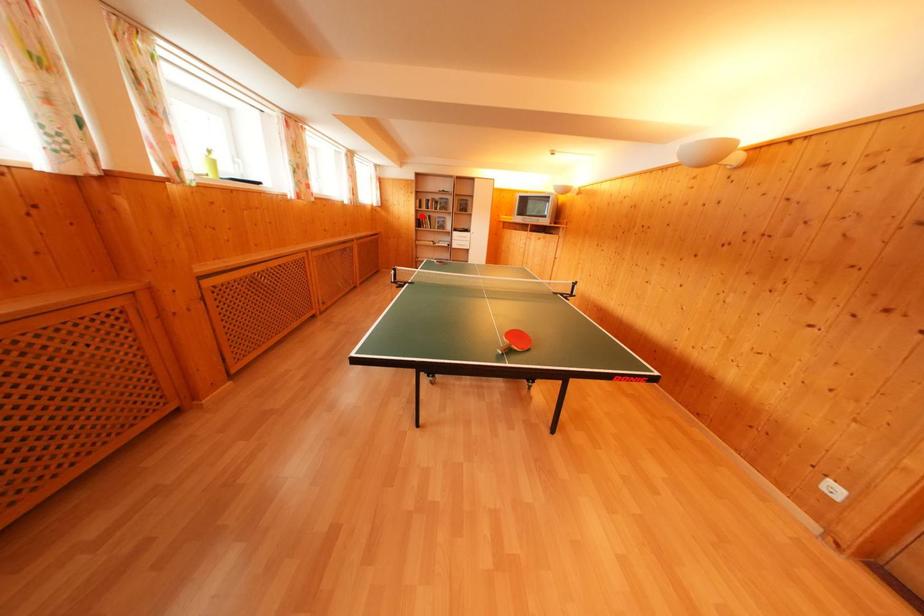
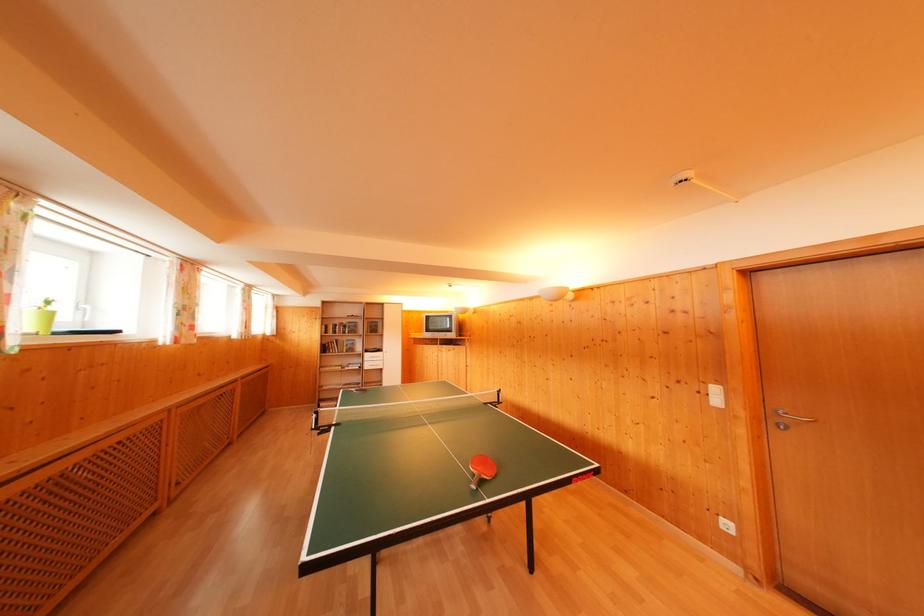
Find the pixel in the second image that matches the highlighted location in the first image.

(326, 342)